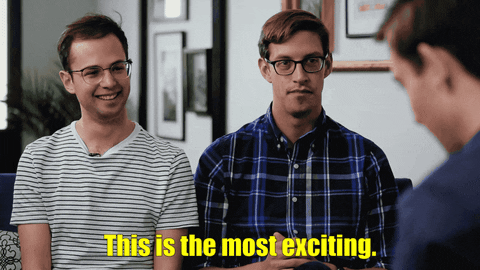
Find the location of a particular element. This screenshot has height=270, width=480. sash is located at coordinates (221, 97), (6, 57).